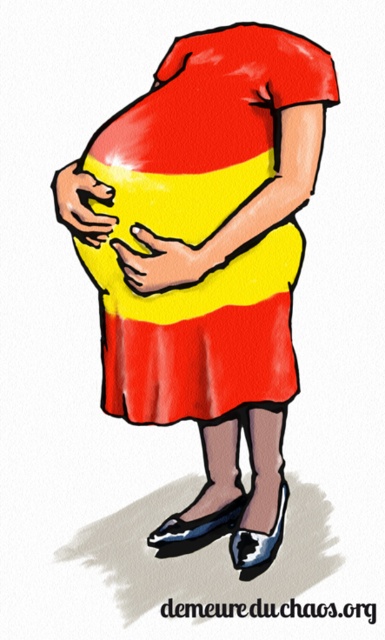
Does matte red dress at center have a greater width compared to matte yellow hand at center?

Indeed, matte red dress at center has a greater width compared to matte yellow hand at center.

Consider the image. Can you confirm if matte red dress at center is bigger than matte yellow hand at center?

Correct, matte red dress at center is larger in size than matte yellow hand at center.

Which is in front, point (182, 164) or point (92, 209)?

Point (182, 164)

This screenshot has width=385, height=640. I want to click on matte red dress at center, so click(x=214, y=262).

Is point (287, 260) more distant than point (132, 262)?

That is True.

Locate an element on the screen. yellow matte dress at center is located at coordinates (199, 333).

Can you confirm if matte red dress at center is bigger than yellow matte dress at center?

Yes.

Between matte red dress at center and yellow matte dress at center, which one appears on the right side from the viewer's perspective?

From the viewer's perspective, matte red dress at center appears more on the right side.

Who is more distant from viewer, (103,333) or (242,259)?

The point (103,333) is behind.

You are a GUI agent. You are given a task and a screenshot of the screen. Output one action in this format:
    pyautogui.click(x=<x>, y=<y>)
    Task: Click on the matte red dress at center
    
    Given the screenshot: What is the action you would take?
    pyautogui.click(x=214, y=262)